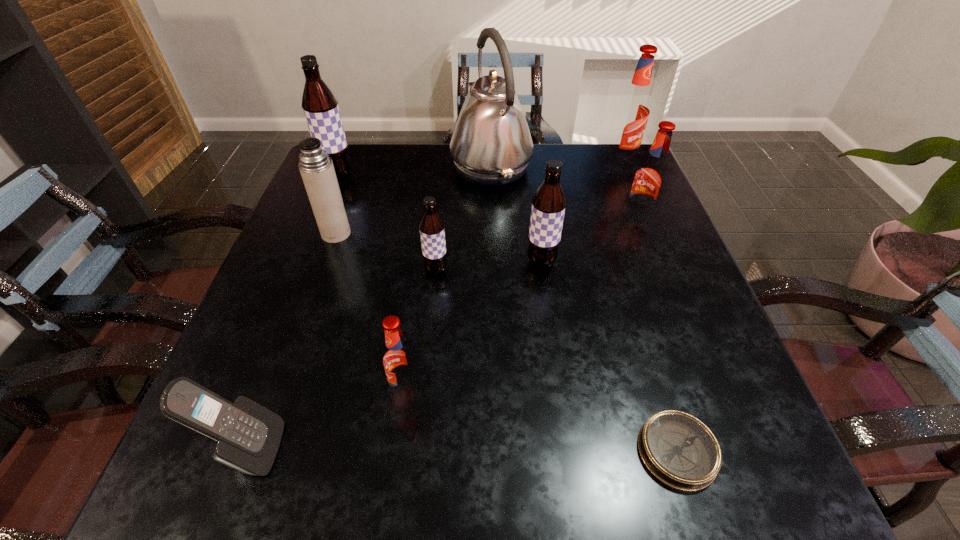
Image resolution: width=960 pixels, height=540 pixels. I want to click on compass that is at the right edge, so click(678, 449).

Locate an element on the screen. The height and width of the screenshot is (540, 960). object situated at the far left corner is located at coordinates (320, 105).

I want to click on object that is at the near left corner, so [x=248, y=435].

Find the location of a particular element. This screenshot has width=960, height=540. object present at the far right corner is located at coordinates (633, 109).

What are the coordinates of `object that is at the near right corner` in the screenshot? It's located at (678, 449).

The width and height of the screenshot is (960, 540). In the image, there is a desktop. Identify the location of vacant area at the far edge. (434, 158).

Locate an element on the screen. vacant space at the near edge of the desktop is located at coordinates (642, 477).

Locate an element on the screen. Image resolution: width=960 pixels, height=540 pixels. free space at the left edge of the desktop is located at coordinates (279, 359).

The image size is (960, 540). In order to click on vacant area at the right edge of the desktop in this screenshot , I will do `click(671, 234)`.

Identify the location of vacant region at the far left corner of the desktop. (380, 157).